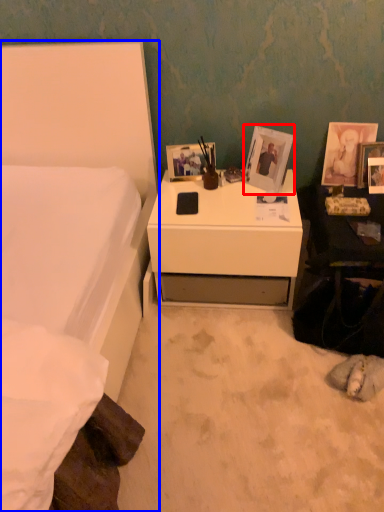
Question: Which point is further to the camera, picture frame (highlighted by a red box) or bed (highlighted by a blue box)?

Choices:
 (A) picture frame
 (B) bed

Answer: (A)